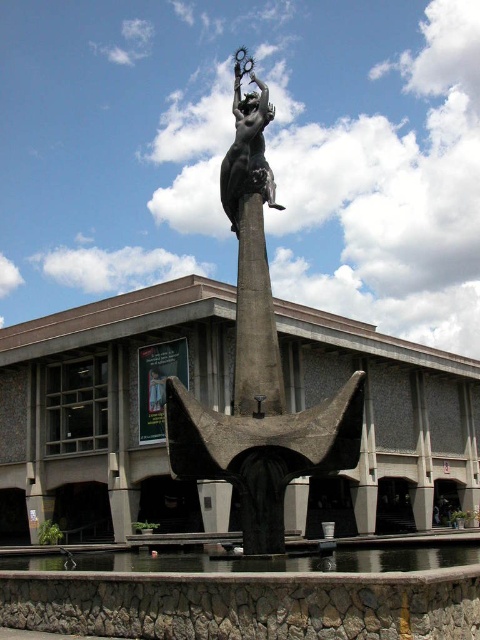
Question: Among these objects, which one is nearest to the camera?

Choices:
 (A) polished bronze statue at center
 (B) bronze statue at center

Answer: (B)

Question: From the image, what is the correct spatial relationship of bronze statue at center in relation to slate gray stone pillar at center?

Choices:
 (A) left
 (B) right

Answer: (A)

Question: Does bronze statue at center have a greater width compared to slate gray stone pillar at center?

Choices:
 (A) no
 (B) yes

Answer: (B)

Question: Which object is closer to the camera taking this photo?

Choices:
 (A) bronze statue at center
 (B) polished bronze statue at center

Answer: (A)

Question: Can you confirm if bronze statue at center is positioned above slate gray stone pillar at center?

Choices:
 (A) no
 (B) yes

Answer: (A)

Question: Based on their relative distances, which object is nearer to the polished bronze statue at center?

Choices:
 (A) bronze statue at center
 (B) slate gray stone pillar at center

Answer: (B)